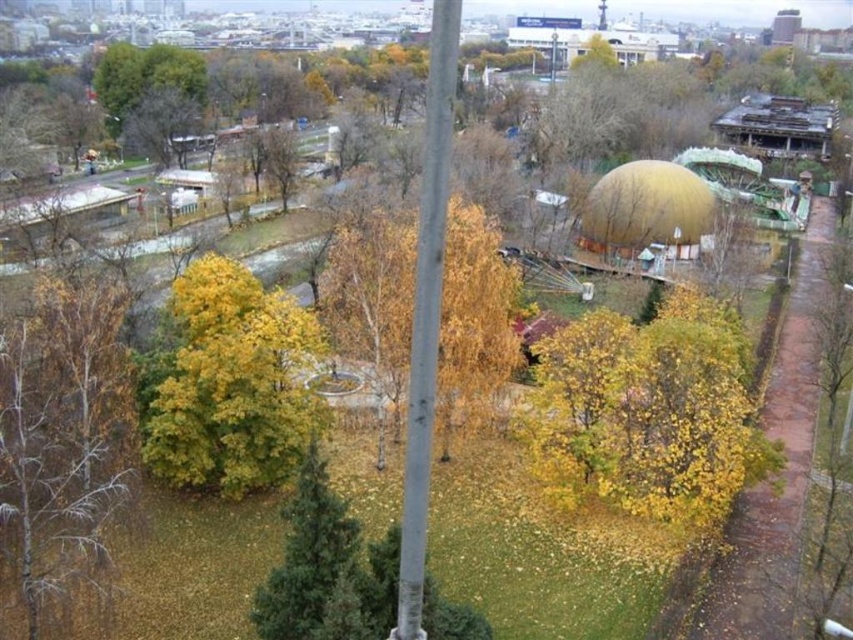
Question: Which point is closer to the camera?

Choices:
 (A) [193, 307]
 (B) [434, 296]
 (C) [18, 570]
 (D) [299, 522]

Answer: (B)

Question: Is brown/dry wood tree at left wider than green matte tree at center?

Choices:
 (A) yes
 (B) no

Answer: (B)

Question: Is brown/dry wood tree at left above green matte tree at center?

Choices:
 (A) yes
 (B) no

Answer: (A)

Question: Based on their relative distances, which object is nearer to the green matte tree at center?

Choices:
 (A) silver metallic pole at center
 (B) yellow matte tree at lower right
 (C) yellow leafy tree at center
 (D) brown/dry wood tree at left

Answer: (A)

Question: Is brown/dry wood tree at left in front of yellow leafy tree at center?

Choices:
 (A) no
 (B) yes

Answer: (A)

Question: Among these objects, which one is farthest from the camera?

Choices:
 (A) green matte tree at center
 (B) yellow matte tree at lower right

Answer: (B)